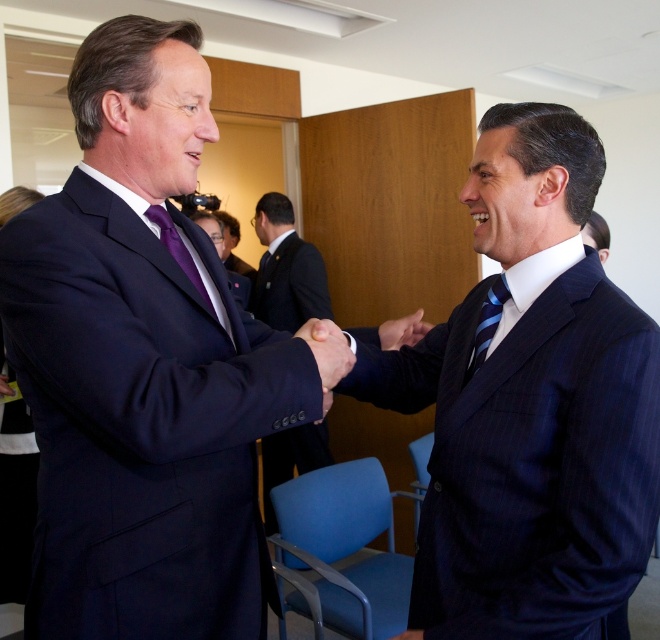
Does smooth skin handshake at center have a larger size compared to matte black suit at right?

No.

Between point (327, 340) and point (597, 228), which one is positioned behind?

Point (597, 228)

Where is `smooth skin handshake at center`? smooth skin handshake at center is located at coordinates (327, 349).

Is point (290, 332) farther from viewer compared to point (330, 372)?

Yes.

Is dark blue suit at center positioned at the back of smooth skin handshake at center?

Yes, it is.

Describe the element at coordinates (286, 269) in the screenshot. I see `dark blue suit at center` at that location.

Image resolution: width=660 pixels, height=640 pixels. Identify the location of dark blue suit at center. (286, 269).

From the picture: Who is taller, blue pinstripe suit at center or purple silk tie at left?

Standing taller between the two is blue pinstripe suit at center.

Is blue pinstripe suit at center above purple silk tie at left?

No.

The height and width of the screenshot is (640, 660). Identify the location of blue pinstripe suit at center. (531, 406).